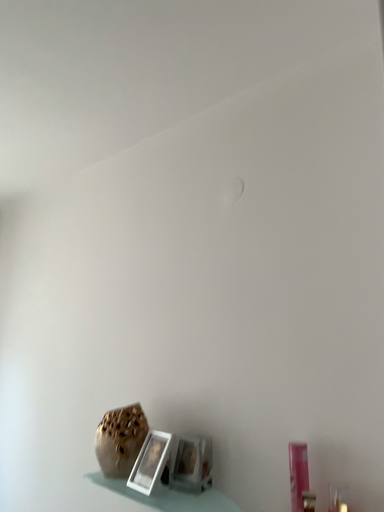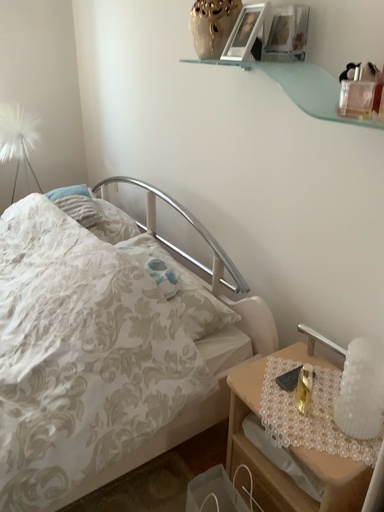
Question: How did the camera likely rotate when shooting the video?

Choices:
 (A) rotated upward
 (B) rotated downward

Answer: (B)